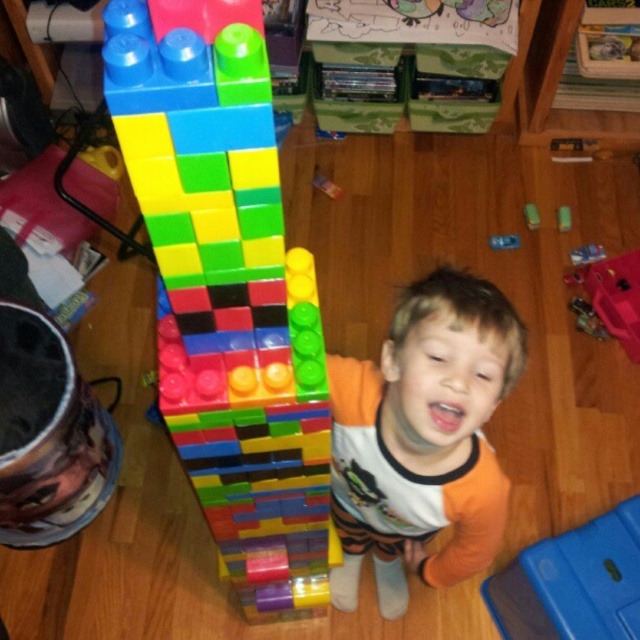
Question: Is the position of orange cotton toddler at center less distant than that of green rubber eraser at center?

Choices:
 (A) yes
 (B) no

Answer: (A)

Question: Can you confirm if bright plastic blocks at center is positioned above metallic blue remote at center?

Choices:
 (A) yes
 (B) no

Answer: (B)

Question: Considering the relative positions of bright plastic blocks at center and green matte eraser at center in the image provided, where is bright plastic blocks at center located with respect to green matte eraser at center?

Choices:
 (A) below
 (B) above

Answer: (A)

Question: Which of these objects is positioned closest to the orange cotton toddler at center?

Choices:
 (A) green matte eraser at center
 (B) green rubber eraser at center

Answer: (B)

Question: Which object appears farthest from the camera in this image?

Choices:
 (A) orange cotton toddler at center
 (B) green rubber eraser at center

Answer: (B)

Question: Which of the following is the farthest from the observer?

Choices:
 (A) (460, 364)
 (B) (577, 250)

Answer: (B)